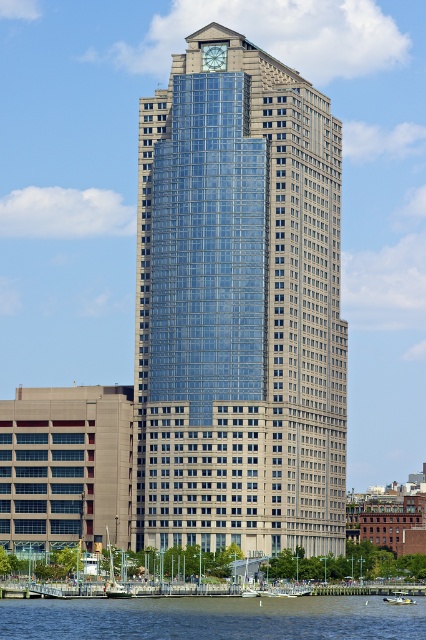
Question: Which point is farther to the camera?

Choices:
 (A) (109, 580)
 (B) (400, 600)

Answer: (A)

Question: Does blue water at lower center have a larger size compared to green plastic boat at lower right?

Choices:
 (A) no
 (B) yes

Answer: (B)

Question: Does white wooden sailboat at lower center have a greater width compared to green plastic boat at lower right?

Choices:
 (A) yes
 (B) no

Answer: (B)

Question: Does white wooden sailboat at lower center lie behind green plastic boat at lower right?

Choices:
 (A) no
 (B) yes

Answer: (A)

Question: Which of the following is the closest to the observer?

Choices:
 (A) (109, 577)
 (B) (397, 595)
 (C) (244, 592)
 (D) (282, 401)

Answer: (C)

Question: Among these objects, which one is nearest to the camera?

Choices:
 (A) blue water at lower center
 (B) glassy blue skyscraper at center
 (C) white wooden sailboat at lower center
 (D) green plastic boat at lower right

Answer: (A)